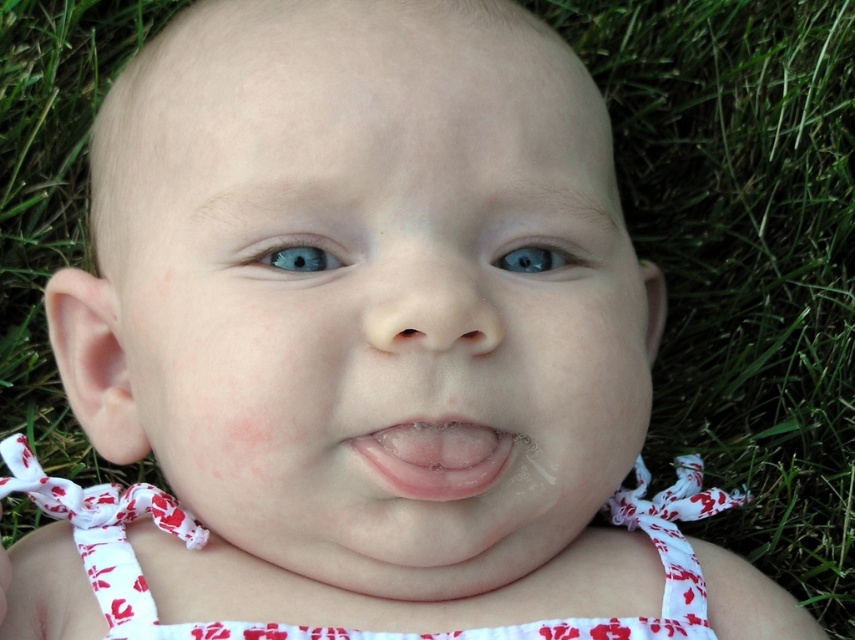
Is point (410, 260) less distant than point (455, 428)?

Yes.

You are a GUI agent. You are given a task and a screenshot of the screen. Output one action in this format:
    pyautogui.click(x=<x>, y=<y>)
    Task: Click on the smooth flesh nose at center
    
    Given the screenshot: What is the action you would take?
    pyautogui.click(x=429, y=305)

Is smooth skin baby at center to the left of smooth flesh nose at center from the viewer's perspective?

Correct, you'll find smooth skin baby at center to the left of smooth flesh nose at center.

Between point (339, 81) and point (417, 268), which one is positioned in front?

Point (417, 268)

Locate an element on the screen. The width and height of the screenshot is (855, 640). smooth skin baby at center is located at coordinates (378, 291).

Does smooth skin baby at center have a greater width compared to blue smooth eye at center?

Yes.

In the scene shown: Does smooth skin baby at center appear under blue smooth eye at center?

Indeed, smooth skin baby at center is positioned under blue smooth eye at center.

Where is `smooth skin baby at center`? Image resolution: width=855 pixels, height=640 pixels. smooth skin baby at center is located at coordinates (378, 291).